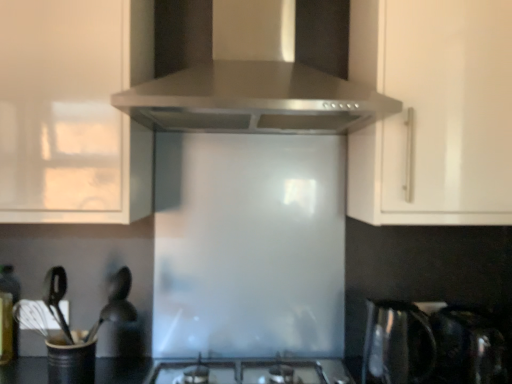
Describe the element at coordinates (9, 311) in the screenshot. I see `translucent glass bottle at lower left` at that location.

What do you see at coordinates (70, 359) in the screenshot? Image resolution: width=512 pixels, height=384 pixels. I see `black matte utensil holder at lower left, which is the 1th appliance in left-to-right order` at bounding box center [70, 359].

Where is `satin silver gas stove at center`? The height and width of the screenshot is (384, 512). satin silver gas stove at center is located at coordinates (280, 374).

Describe the element at coordinates (280, 374) in the screenshot. The height and width of the screenshot is (384, 512). I see `satin silver gas stove at center` at that location.

Find the location of a particular element. white glossy cabinet at upper left, which appears as the first cabinetry when viewed from the left is located at coordinates (73, 111).

Identify the location of satin silver range hood at upper center. pyautogui.click(x=254, y=100).

The width and height of the screenshot is (512, 384). Describe the element at coordinates (468, 347) in the screenshot. I see `satin black kettle at lower right, the second appliance positioned from the left` at that location.

Image resolution: width=512 pixels, height=384 pixels. I want to click on translucent glass bottle at lower left, so click(x=9, y=311).

Between satin black kettle at lower right, the second appliance positioned from the left, and white glossy cabinet handle at upper right, which is the 1th cabinetry from right to left, which one has larger size?

white glossy cabinet handle at upper right, which is the 1th cabinetry from right to left, is bigger.

Which is in front, point (487, 377) or point (475, 12)?

Positioned in front is point (475, 12).

Is the surface of satin black kettle at lower right, arranged as the first appliance when viewed from the right, in direct contact with white glossy cabinet handle at upper right, which is the 1th cabinetry from right to left?

No, satin black kettle at lower right, arranged as the first appliance when viewed from the right, is not touching white glossy cabinet handle at upper right, which is the 1th cabinetry from right to left.

From the image's perspective, is translucent glass bottle at lower left under satin silver range hood at upper center?

Yes.

Is translucent glass bottle at lower left wider or thinner than satin silver range hood at upper center?

In the image, translucent glass bottle at lower left appears to be more narrow than satin silver range hood at upper center.

From a real-world perspective, is translucent glass bottle at lower left positioned above or below satin silver range hood at upper center?

Clearly, from a real-world perspective, translucent glass bottle at lower left is below satin silver range hood at upper center.

In order to click on home appliance that appears above the translucent glass bottle at lower left (from the image's perspective) in this screenshot , I will do `click(254, 100)`.

From a real-world perspective, between satin silver range hood at upper center and satin black kettle at lower right, the second appliance positioned from the left, who is vertically higher?

From a 3D spatial view, satin silver range hood at upper center is above.

Which of these two, satin silver range hood at upper center or satin black kettle at lower right, arranged as the first appliance when viewed from the right, is smaller?

Smaller between the two is satin black kettle at lower right, arranged as the first appliance when viewed from the right.

Can you tell me how much satin silver range hood at upper center and satin black kettle at lower right, arranged as the first appliance when viewed from the right, differ in facing direction?

The angle between the facing direction of satin silver range hood at upper center and the facing direction of satin black kettle at lower right, arranged as the first appliance when viewed from the right, is 5.36e-05 degrees.

Is satin silver range hood at upper center positioned far away from satin black kettle at lower right, arranged as the first appliance when viewed from the right?

No, there isn't a large distance between satin silver range hood at upper center and satin black kettle at lower right, arranged as the first appliance when viewed from the right.

From the image's perspective, does white glossy cabinet handle at upper right, which is the 1th cabinetry from right to left, appear higher than satin silver gas stove at center?

Yes, from the image's perspective, white glossy cabinet handle at upper right, which is the 1th cabinetry from right to left, is on top of satin silver gas stove at center.

Is white glossy cabinet handle at upper right, the second cabinetry viewed from the left, looking in the opposite direction of satin silver gas stove at center?

No, white glossy cabinet handle at upper right, the second cabinetry viewed from the left, is not facing away from satin silver gas stove at center.

Is white glossy cabinet handle at upper right, which is the 1th cabinetry from right to left, positioned before satin silver gas stove at center?

No, it is behind satin silver gas stove at center.

Can you tell me how much satin black kettle at lower right, arranged as the first appliance when viewed from the right, and satin metallic kettle at lower right differ in facing direction?

The facing directions of satin black kettle at lower right, arranged as the first appliance when viewed from the right, and satin metallic kettle at lower right are 0.000574 degrees apart.

From the image's perspective, is satin black kettle at lower right, the second appliance positioned from the left, beneath satin metallic kettle at lower right?

Correct, satin black kettle at lower right, the second appliance positioned from the left, appears lower than satin metallic kettle at lower right in the image.

Consider the image. Between satin black kettle at lower right, arranged as the first appliance when viewed from the right, and satin metallic kettle at lower right, which one is positioned behind?

satin black kettle at lower right, arranged as the first appliance when viewed from the right, is behind.

How different are the orientations of black matte utensil holder at lower left, which is the 1th appliance in left-to-right order, and satin black kettle at lower right, the second appliance positioned from the left, in degrees?

The angle between the facing direction of black matte utensil holder at lower left, which is the 1th appliance in left-to-right order, and the facing direction of satin black kettle at lower right, the second appliance positioned from the left, is 0.00141 degrees.

Is black matte utensil holder at lower left, which is the 1th appliance in left-to-right order, positioned beyond the bounds of satin black kettle at lower right, the second appliance positioned from the left?

Yes, black matte utensil holder at lower left, which is the 1th appliance in left-to-right order, is located beyond the bounds of satin black kettle at lower right, the second appliance positioned from the left.

Can you confirm if black matte utensil holder at lower left, the 2th appliance viewed from the right, is taller than satin black kettle at lower right, arranged as the first appliance when viewed from the right?

Incorrect, the height of black matte utensil holder at lower left, the 2th appliance viewed from the right, is not larger of that of satin black kettle at lower right, arranged as the first appliance when viewed from the right.

Where is `appliance that is above the black matte utensil holder at lower left, the 2th appliance viewed from the right (from a real-world perspective)`? Image resolution: width=512 pixels, height=384 pixels. appliance that is above the black matte utensil holder at lower left, the 2th appliance viewed from the right (from a real-world perspective) is located at coordinates (468, 347).

How far apart are satin silver range hood at upper center and white glossy cabinet at upper left, which is the second cabinetry in right-to-left order?

satin silver range hood at upper center is 10.71 inches away from white glossy cabinet at upper left, which is the second cabinetry in right-to-left order.

Between satin silver range hood at upper center and white glossy cabinet at upper left, which appears as the first cabinetry when viewed from the left, which one is positioned behind?

white glossy cabinet at upper left, which appears as the first cabinetry when viewed from the left, is more distant.

Is satin silver range hood at upper center facing towards white glossy cabinet at upper left, which is the second cabinetry in right-to-left order?

No.

Where is `home appliance located above the white glossy cabinet at upper left, which appears as the first cabinetry when viewed from the left (from a real-world perspective)`? This screenshot has width=512, height=384. home appliance located above the white glossy cabinet at upper left, which appears as the first cabinetry when viewed from the left (from a real-world perspective) is located at coordinates (254, 100).

Image resolution: width=512 pixels, height=384 pixels. What are the coordinates of `appliance on the right of white glossy cabinet handle at upper right, which is the 1th cabinetry from right to left` in the screenshot? It's located at (468, 347).

This screenshot has width=512, height=384. Find the location of `bottle below the satin silver range hood at upper center (from the image's perspective)`. bottle below the satin silver range hood at upper center (from the image's perspective) is located at coordinates (9, 311).

Based on their spatial positions, is white glossy cabinet at upper left, which is the second cabinetry in right-to-left order, or satin metallic kettle at lower right closer to satin silver gas stove at center?

satin metallic kettle at lower right is positioned closer to the anchor satin silver gas stove at center.

When comparing their distances from white glossy cabinet at upper left, which appears as the first cabinetry when viewed from the left, does satin black kettle at lower right, arranged as the first appliance when viewed from the right, or black matte utensil holder at lower left, which is the 1th appliance in left-to-right order, seem closer?

black matte utensil holder at lower left, which is the 1th appliance in left-to-right order, lies closer to white glossy cabinet at upper left, which appears as the first cabinetry when viewed from the left, than the other object.

Based on their spatial positions, is black matte utensil holder at lower left, which is the 1th appliance in left-to-right order, or satin silver gas stove at center closer to white glossy cabinet handle at upper right, which is the 1th cabinetry from right to left?

The object closer to white glossy cabinet handle at upper right, which is the 1th cabinetry from right to left, is satin silver gas stove at center.

Which object lies nearer to the anchor point satin black kettle at lower right, arranged as the first appliance when viewed from the right, satin metallic kettle at lower right or satin silver gas stove at center?

satin metallic kettle at lower right lies closer to satin black kettle at lower right, arranged as the first appliance when viewed from the right, than the other object.

From the image, which object appears to be farther from white glossy cabinet handle at upper right, which is the 1th cabinetry from right to left, satin black kettle at lower right, arranged as the first appliance when viewed from the right, or translucent glass bottle at lower left?

The object further to white glossy cabinet handle at upper right, which is the 1th cabinetry from right to left, is translucent glass bottle at lower left.

Which object lies nearer to the anchor point translucent glass bottle at lower left, satin silver range hood at upper center or black matte utensil holder at lower left, which is the 1th appliance in left-to-right order?

Among the two, black matte utensil holder at lower left, which is the 1th appliance in left-to-right order, is located nearer to translucent glass bottle at lower left.

Looking at the image, which one is located closer to white glossy cabinet at upper left, which appears as the first cabinetry when viewed from the left, satin metallic kettle at lower right or black matte utensil holder at lower left, the 2th appliance viewed from the right?

black matte utensil holder at lower left, the 2th appliance viewed from the right.

Estimate the real-world distances between objects in this image. Which object is further from satin silver gas stove at center, satin black kettle at lower right, arranged as the first appliance when viewed from the right, or satin metallic kettle at lower right?

satin black kettle at lower right, arranged as the first appliance when viewed from the right, lies further to satin silver gas stove at center than the other object.

This screenshot has height=384, width=512. In order to click on cabinetry between translucent glass bottle at lower left and white glossy cabinet handle at upper right, the second cabinetry viewed from the left, in the horizontal direction in this screenshot , I will do `click(73, 111)`.

Where is `home appliance between translucent glass bottle at lower left and white glossy cabinet handle at upper right, the second cabinetry viewed from the left, in the horizontal direction`? home appliance between translucent glass bottle at lower left and white glossy cabinet handle at upper right, the second cabinetry viewed from the left, in the horizontal direction is located at coordinates (254, 100).

Where is `kitchen appliance between satin silver range hood at upper center and black matte utensil holder at lower left, the 2th appliance viewed from the right, vertically`? The height and width of the screenshot is (384, 512). kitchen appliance between satin silver range hood at upper center and black matte utensil holder at lower left, the 2th appliance viewed from the right, vertically is located at coordinates (x=397, y=344).

Where is `kitchen appliance between satin silver range hood at upper center and satin silver gas stove at center in the vertical direction`? kitchen appliance between satin silver range hood at upper center and satin silver gas stove at center in the vertical direction is located at coordinates (397, 344).